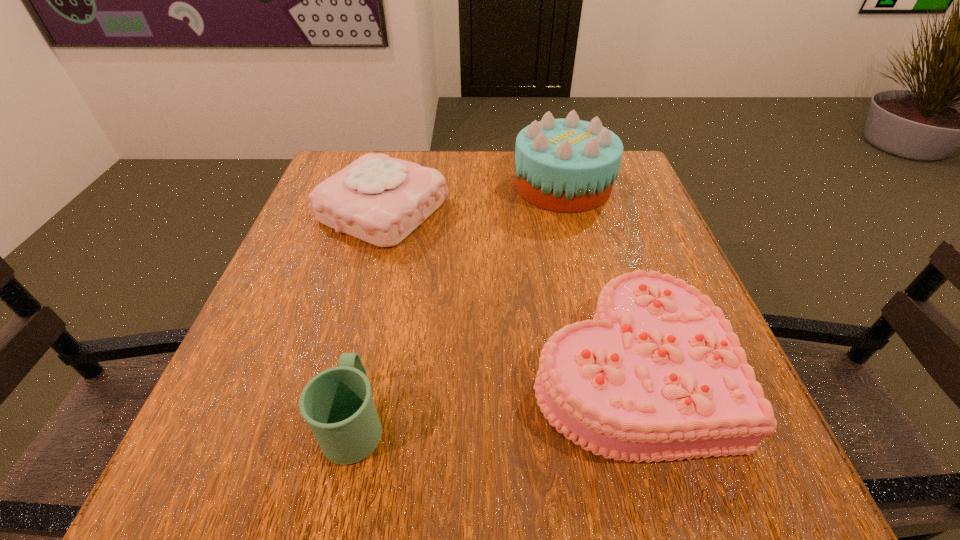
At what (x,y) coordinates should I click in order to perform the action: click on free space at the far left corner of the desktop. Please return your answer as a coordinate pair (x, y). The width and height of the screenshot is (960, 540). Looking at the image, I should click on (353, 154).

Locate an element on the screen. Image resolution: width=960 pixels, height=540 pixels. vacant space at the near left corner is located at coordinates (184, 457).

Locate an element on the screen. free space between the leftmost cake and the tallest object is located at coordinates (473, 198).

You are a GUI agent. You are given a task and a screenshot of the screen. Output one action in this format:
    pyautogui.click(x=<x>, y=<y>)
    Task: Click on the free space between the nearest cake and the tallest cake
    The height and width of the screenshot is (540, 960).
    Given the screenshot: What is the action you would take?
    pyautogui.click(x=595, y=276)

Where is `unoccupied area between the leftmost cake and the shortest object`? Image resolution: width=960 pixels, height=540 pixels. unoccupied area between the leftmost cake and the shortest object is located at coordinates (505, 289).

Where is `vacant space that is in between the tallest object and the mug`? Image resolution: width=960 pixels, height=540 pixels. vacant space that is in between the tallest object and the mug is located at coordinates (459, 304).

Where is `free space between the tallest cake and the leftmost cake`? free space between the tallest cake and the leftmost cake is located at coordinates [x=473, y=198].

Find the location of a particular element. The image size is (960, 540). free space between the shortest cake and the leftmost cake is located at coordinates (505, 289).

Locate an element on the screen. free space between the tallest cake and the leftmost cake is located at coordinates (473, 198).

Locate an element on the screen. The height and width of the screenshot is (540, 960). empty location between the tallest object and the leftmost cake is located at coordinates (473, 198).